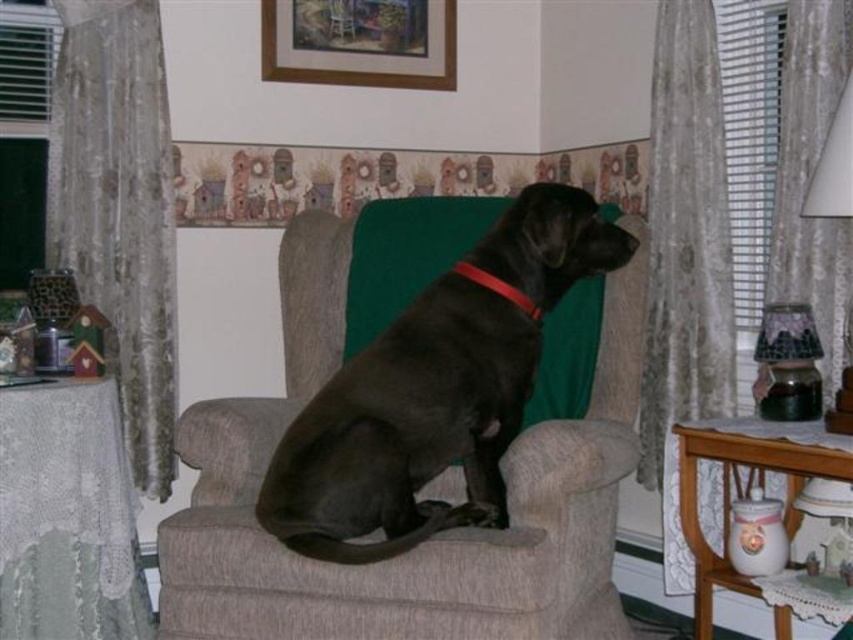
You are standing in the living room and want to hang a new picture. You have two options to place it either on the sheer floral lace curtain at right or above the wooden picture frame at upper center. Which location is closer to you?

The sheer floral lace curtain at right is closer to the viewer than the wooden picture frame at upper center, so placing the new picture on the sheer floral lace curtain at right would be closer to you.

You are standing in the living room and want to hang a new picture frame. The existing wooden picture frame at upper center is currently at coordinates point 0.067, 0.423. If you want to place your new frame to the right of it, where should you position it?

To place your new frame to the right of the wooden picture frame at upper center, position it at a coordinate with an x value greater than 0.067, such as 0.134, while keeping the y value around 0.423 to maintain the same height.

You are standing in the living room and want to take a photo of both the dog and the framed picture on the wall. Which point, point (780,198) or point (297,49), should you focus on to ensure both subjects are in clear view?

You should focus on point (780,198) because it is closer to the camera than point (297,49), ensuring the dog and framed picture are both in focus.